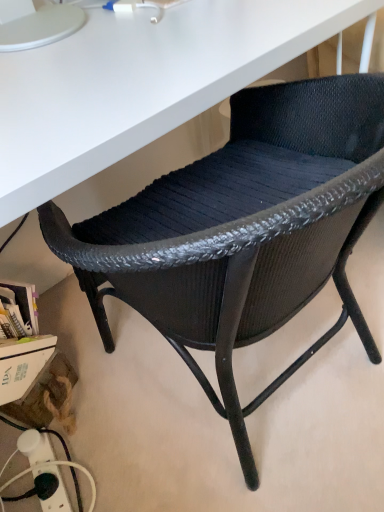
Question: Is point (97, 226) positioned closer to the camera than point (26, 453)?

Choices:
 (A) farther
 (B) closer

Answer: (B)

Question: Considering the positions of black woven chair at center and black plastic power strip at lower left in the image, is black woven chair at center taller or shorter than black plastic power strip at lower left?

Choices:
 (A) short
 (B) tall

Answer: (B)

Question: Is black woven chair at center bigger or smaller than black plastic power strip at lower left?

Choices:
 (A) small
 (B) big

Answer: (B)

Question: Based on their sizes in the image, would you say black plastic power strip at lower left is bigger or smaller than black woven chair at center?

Choices:
 (A) small
 (B) big

Answer: (A)

Question: Considering their positions, is black plastic power strip at lower left located in front of or behind black woven chair at center?

Choices:
 (A) front
 (B) behind

Answer: (B)

Question: Considering the positions of point (66, 501) and point (226, 357), is point (66, 501) closer or farther from the camera than point (226, 357)?

Choices:
 (A) closer
 (B) farther

Answer: (B)

Question: Which is correct: black plastic power strip at lower left is inside black woven chair at center, or outside of it?

Choices:
 (A) outside
 (B) inside

Answer: (A)